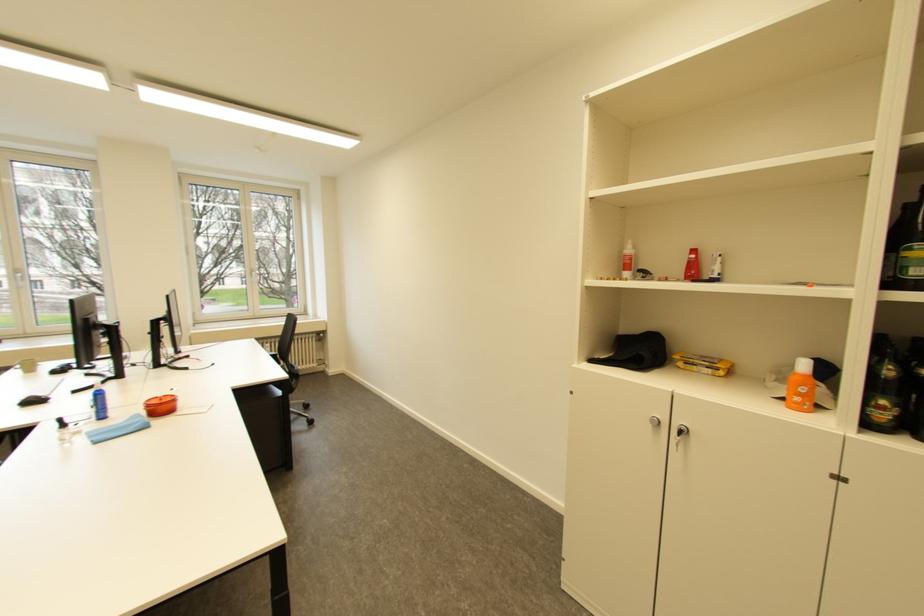
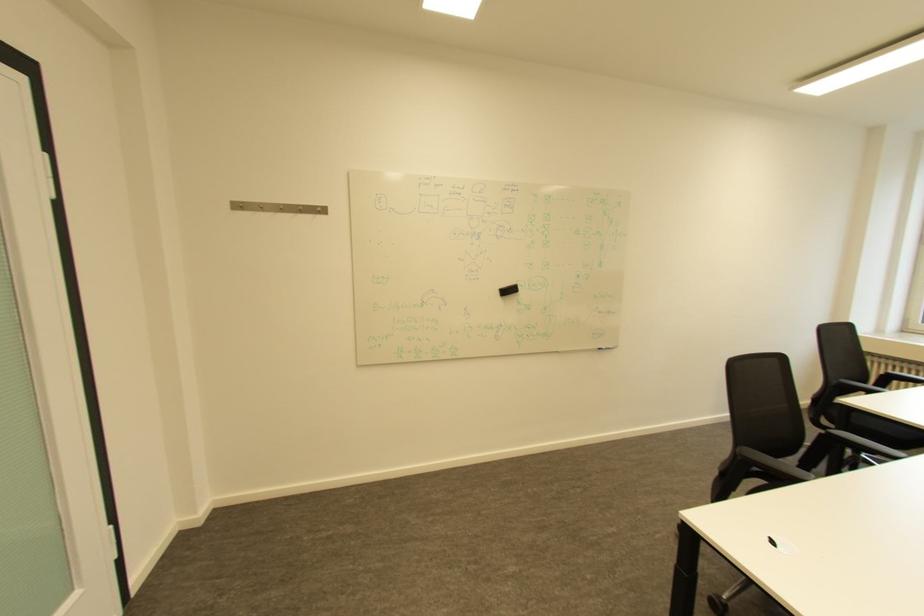
Question: The camera is either moving clockwise (left) or counter-clockwise (right) around the object. The first image is from the beginning of the video and the second image is from the end. Is the camera moving left or right when shooting the video?

Choices:
 (A) Left
 (B) Right

Answer: (B)